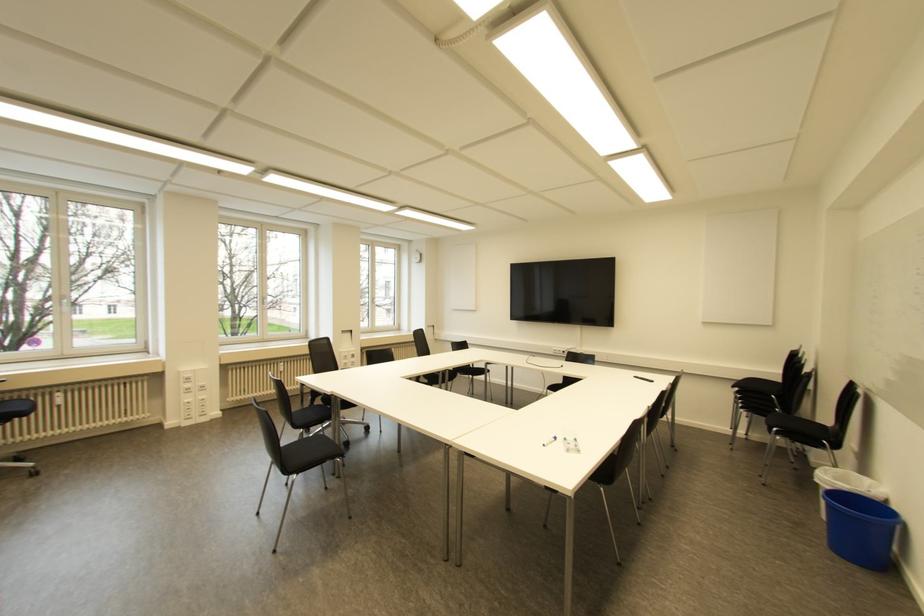
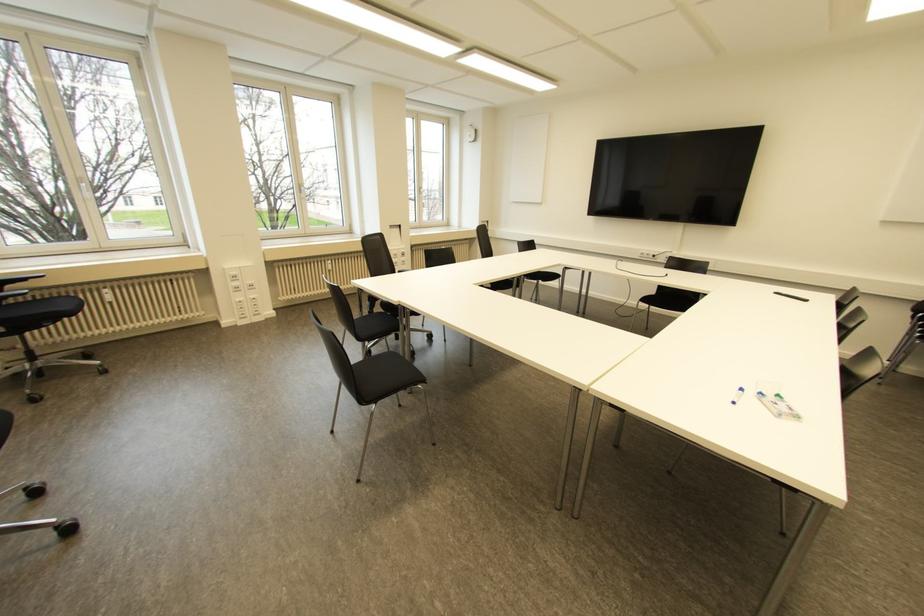
Where in the second image is the point corresponding to (186,376) from the first image?

(232, 273)